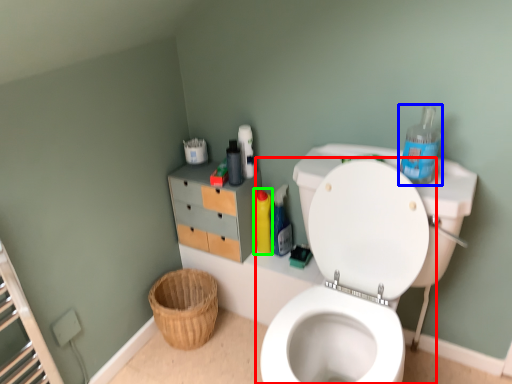
Question: Estimate the real-world distances between objects in this image. Which object is farther from toilet (highlighted by a red box), cleaning product (highlighted by a blue box) or cleaning product (highlighted by a green box)?

Choices:
 (A) cleaning product
 (B) cleaning product

Answer: (B)